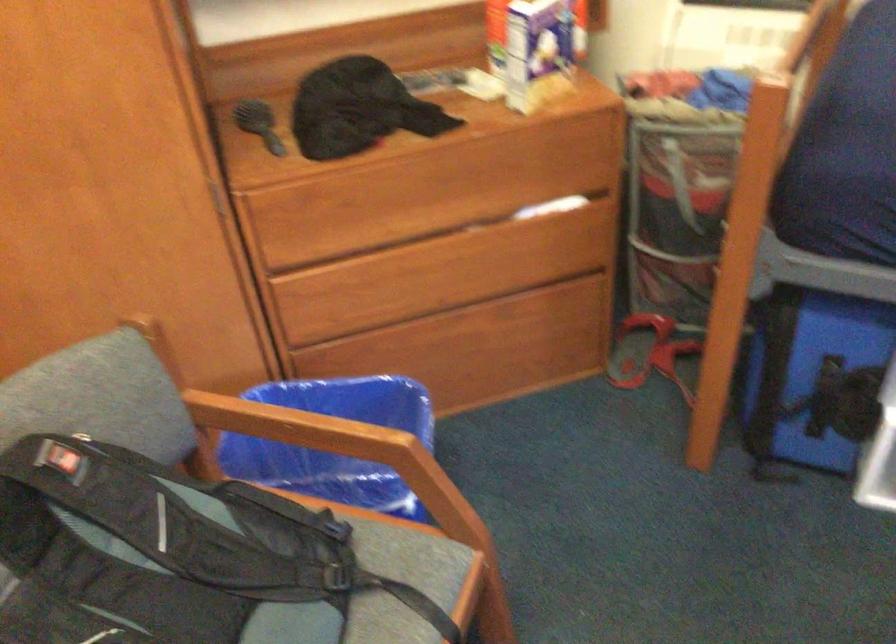
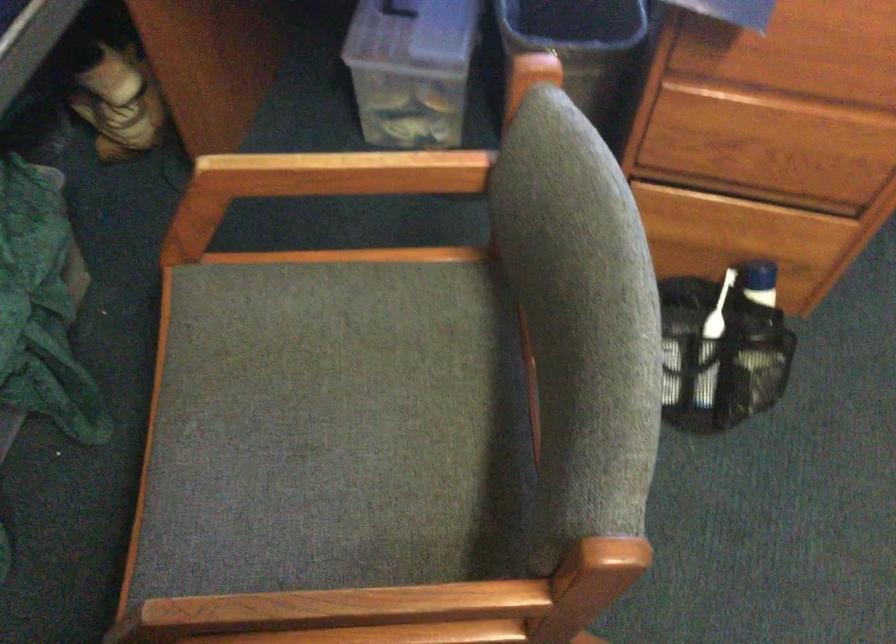
First-person continuous shooting, in which direction is the camera rotating?

The camera rotated toward right-down.